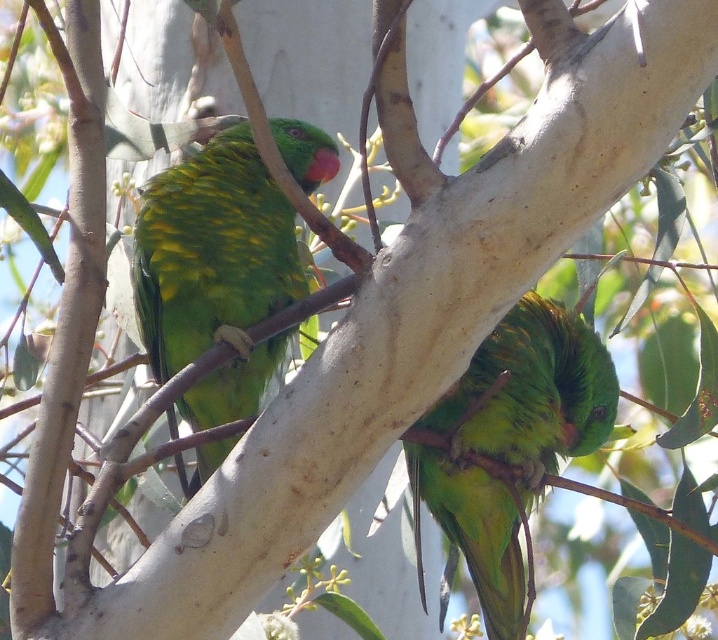
From the picture: You are a birdwatcher trying to identify two green matte parrots in the image. Which of the two parrots, the green matte parrot at upper left or the green matte parrot at center, appears smaller in width?

The green matte parrot at upper left has a lesser width compared to the green matte parrot at center, so it appears smaller in width.

You are a birdwatcher trying to capture both green matte parrot at upper left and green matte parrot at center in a single photo. The camera you are using has a maximum focus range of 35 centimeters. Can you fit both birds into the frame without moving the camera?

The distance between the green matte parrot at upper left and green matte parrot at center is 37.17 centimeters, which exceeds the camera maximum focus range of 35 centimeters. Therefore, you cannot fit both birds into the frame without moving the camera.

You are a birdwatcher trying to determine which of the two points, point (x=299, y=262) or point (x=429, y=512), is closer to you while observing the eucalyptus tree. Based on the image, which point is nearer to your position?

Point (x=299, y=262) is closer to you than point (x=429, y=512) because it is positioned further to the viewer in the image.